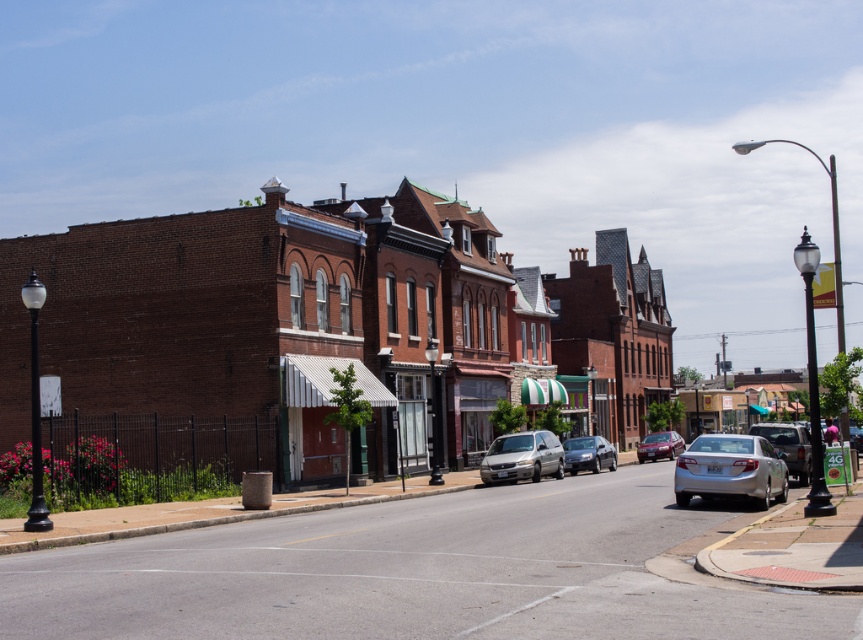
Question: Which point is closer to the camera?

Choices:
 (A) (526, 461)
 (B) (128, 244)
 (C) (569, 445)

Answer: (A)

Question: Does silver metallic sedan at right appear on the right side of shiny silver sedan at center?

Choices:
 (A) no
 (B) yes

Answer: (B)

Question: Which point is closer to the camera?

Choices:
 (A) (511, 460)
 (B) (594, 464)
 (C) (799, 445)
 (D) (291, 392)

Answer: (C)

Question: Among these objects, which one is nearest to the camera?

Choices:
 (A) shiny silver sedan at center
 (B) silver metallic sedan at right

Answer: (B)

Question: Does silver metallic minivan at center appear over shiny silver sedan at center?

Choices:
 (A) yes
 (B) no

Answer: (A)

Question: Considering the relative positions of brown brick building at center and silver metallic minivan at center in the image provided, where is brown brick building at center located with respect to silver metallic minivan at center?

Choices:
 (A) left
 (B) right

Answer: (B)